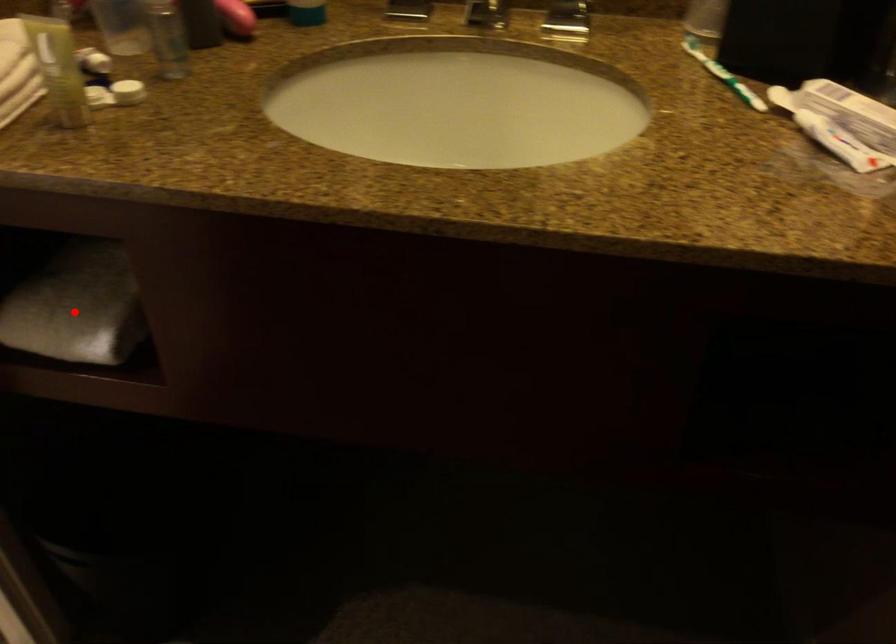
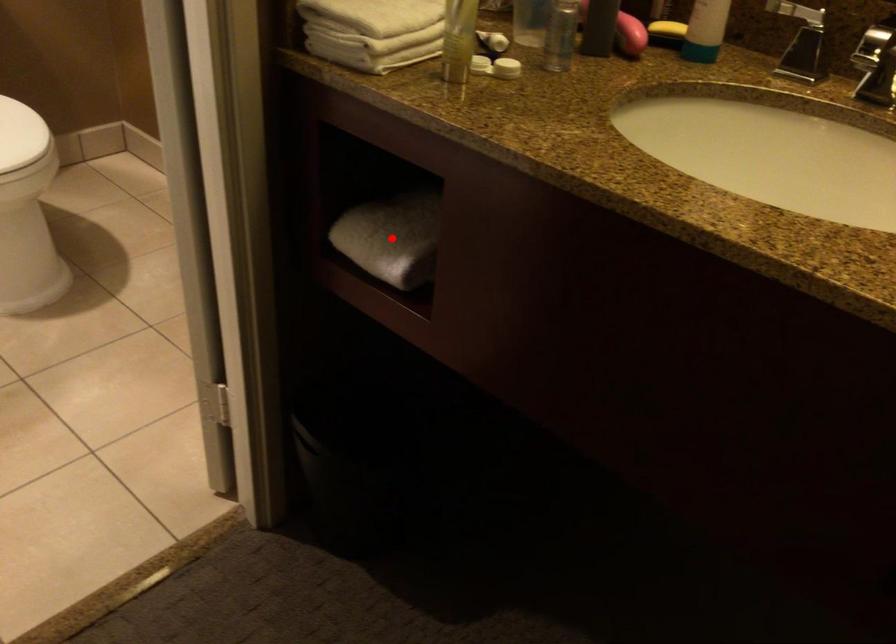
I am providing you with two images of the same scene from different viewpoints. A red point is marked on the first image and another point is marked on the second image. Does the point marked in image1 correspond to the same location as the one in image2?

Yes